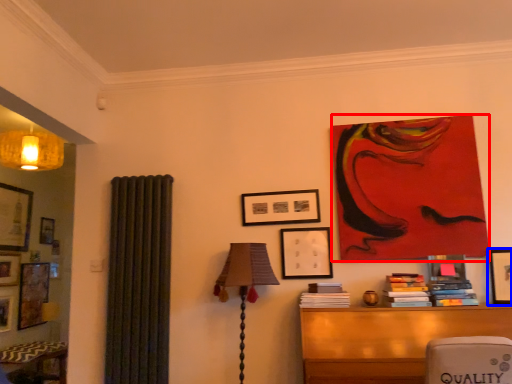
Question: Which of the following is the farthest to the observer, art (highlighted by a red box) or picture frame (highlighted by a blue box)?

Choices:
 (A) art
 (B) picture frame

Answer: (A)